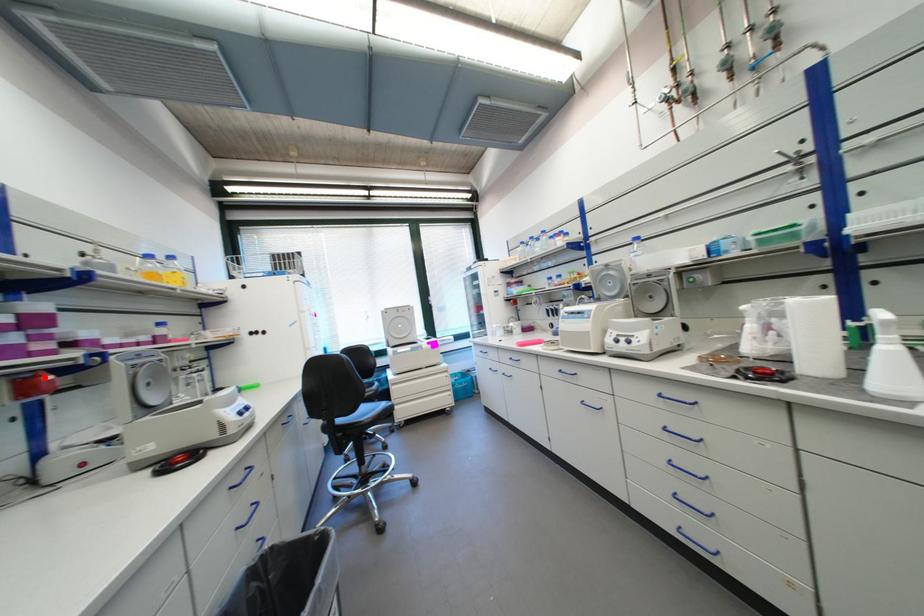
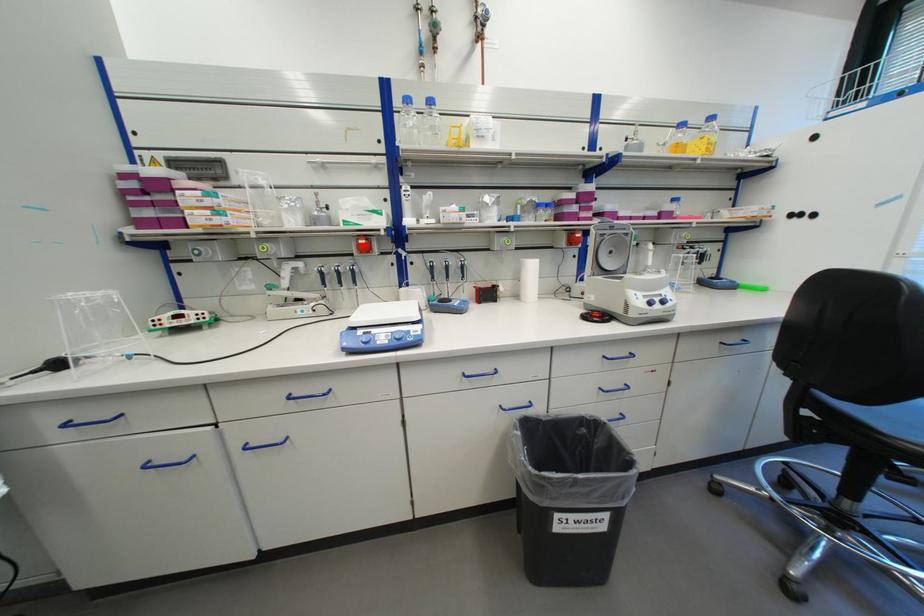
Consider the image. I am providing you with two images of the same scene from different viewpoints. A red point is marked on the first image and another point is marked on the second image. Are the points marked in image1 and image2 representing the same 3D position?

No